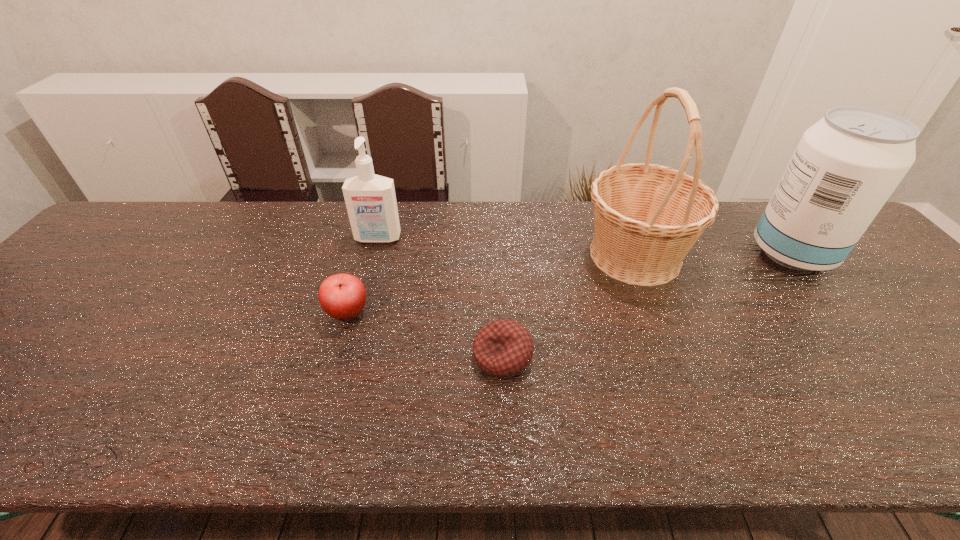
Where is `free location located 0.130m on the back of the rightmost object`? This screenshot has width=960, height=540. free location located 0.130m on the back of the rightmost object is located at coordinates (754, 205).

Find the location of a particular element. Image resolution: width=960 pixels, height=540 pixels. free location located 0.370m on the front label of the third shortest object is located at coordinates (348, 351).

This screenshot has height=540, width=960. In order to click on vacant space located on the back of the fourth tallest object in this screenshot , I will do `click(362, 263)`.

This screenshot has height=540, width=960. In order to click on vacant region located 0.090m on the front of the shortest object in this screenshot , I will do `click(506, 421)`.

You are a GUI agent. You are given a task and a screenshot of the screen. Output one action in this format:
    pyautogui.click(x=<x>, y=<y>)
    Task: Click on the basket located in the far edge section of the desktop
    This screenshot has height=540, width=960.
    Given the screenshot: What is the action you would take?
    pyautogui.click(x=647, y=217)

Find the location of a particular element. alcohol that is at the far edge is located at coordinates (846, 166).

Where is `cleansing agent that is at the far edge`? This screenshot has height=540, width=960. cleansing agent that is at the far edge is located at coordinates (370, 199).

Image resolution: width=960 pixels, height=540 pixels. Identify the location of object that is at the right edge. (846, 166).

Image resolution: width=960 pixels, height=540 pixels. I want to click on object located at the far right corner, so click(x=846, y=166).

Identify the location of vacant region at the far edge of the desktop. (489, 244).